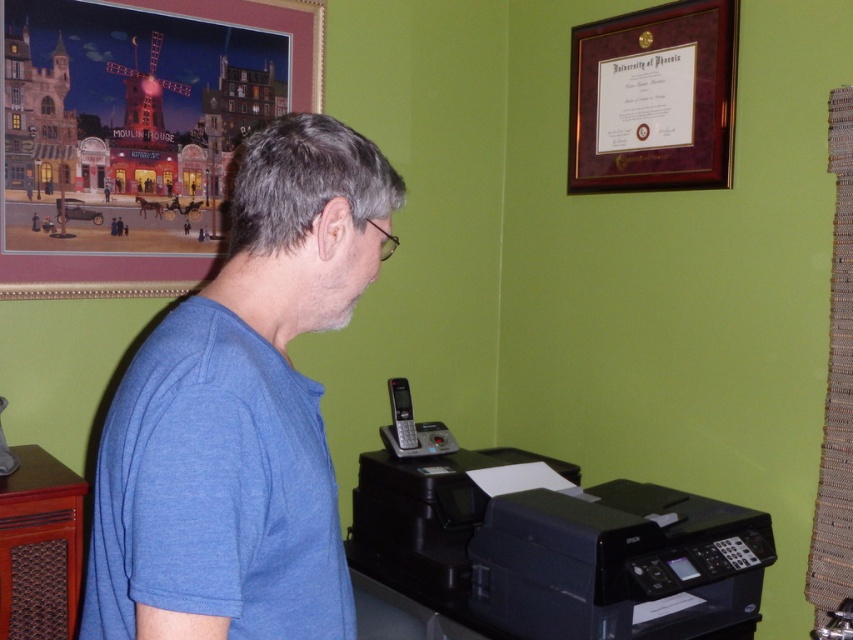
You are an office worker who needs to hang a notice on the bulletin board. The bulletin board is located at the right side of the wall. However, there is a printer blocking your access. Can you reach the metallic mesh bulletin board at right without moving the black plastic printer at lower right?

The black plastic printer at lower right is in front of the metallic mesh bulletin board at right, so you cannot reach the bulletin board without moving the printer.

You are a delivery person who needs to place a new package on the desk where the black plastic printer at lower right is located. The package is 5 feet long. Can you fit the package on the desk without moving the printer?

The distance between the black plastic printer at lower right and the delivery person is 5.16 feet. Since the package is 5 feet long, it can fit on the desk as there is enough space between the printer and the edge of the desk.

You are a delivery person who needs to place a box on the desk where the black plastic printer at lower right is located. The box is 10 cm taller than the blue cotton shirt at center. Will the box fit on the desk without exceeding the desk height?

The blue cotton shirt at center is taller than the black plastic printer at lower right. Since the box is 10 cm taller than the blue cotton shirt at center, it will be even taller than the printer. Therefore, the box may not fit on the desk without exceeding the desk height.